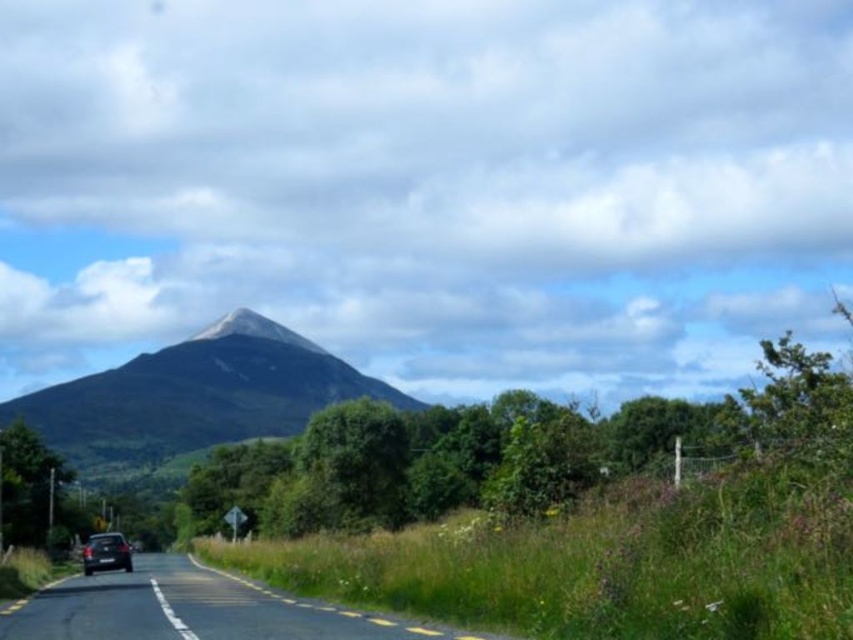
In the scene shown: Is green grassy mountain at center to the left of shiny black car at lower left from the viewer's perspective?

Indeed, green grassy mountain at center is positioned on the left side of shiny black car at lower left.

Between green grassy mountain at center and shiny black car at lower left, which one appears on the left side from the viewer's perspective?

green grassy mountain at center is more to the left.

What are the coordinates of `green grassy mountain at center` in the screenshot? It's located at (195, 396).

This screenshot has height=640, width=853. Identify the location of green grassy mountain at center. (195, 396).